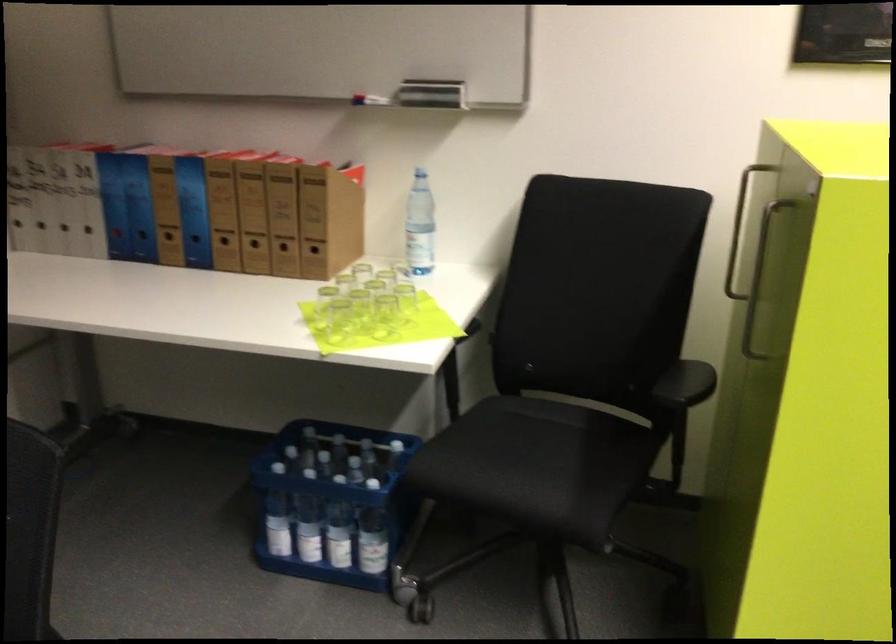
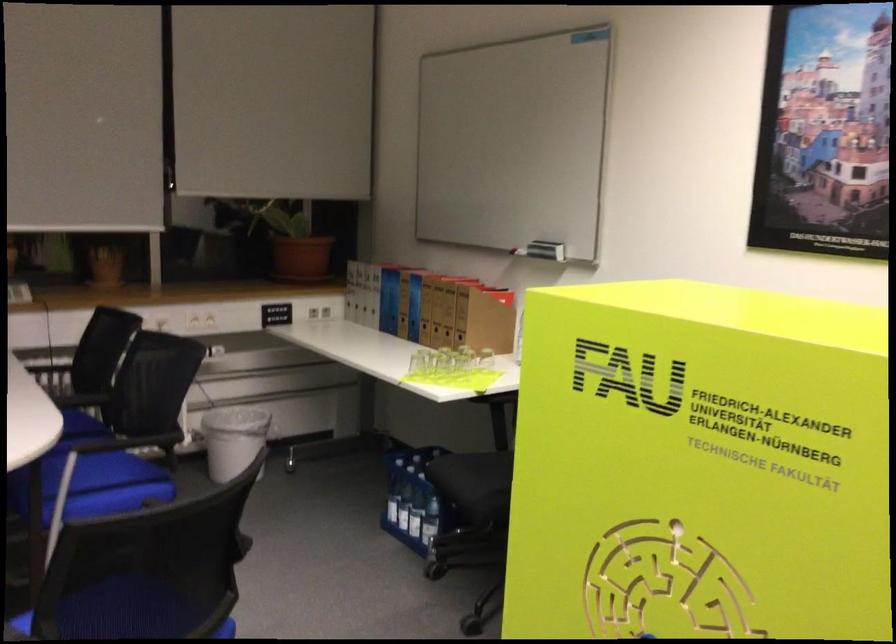
Where in the second image is the point corresponding to point 428,100 from the first image?

(546, 250)